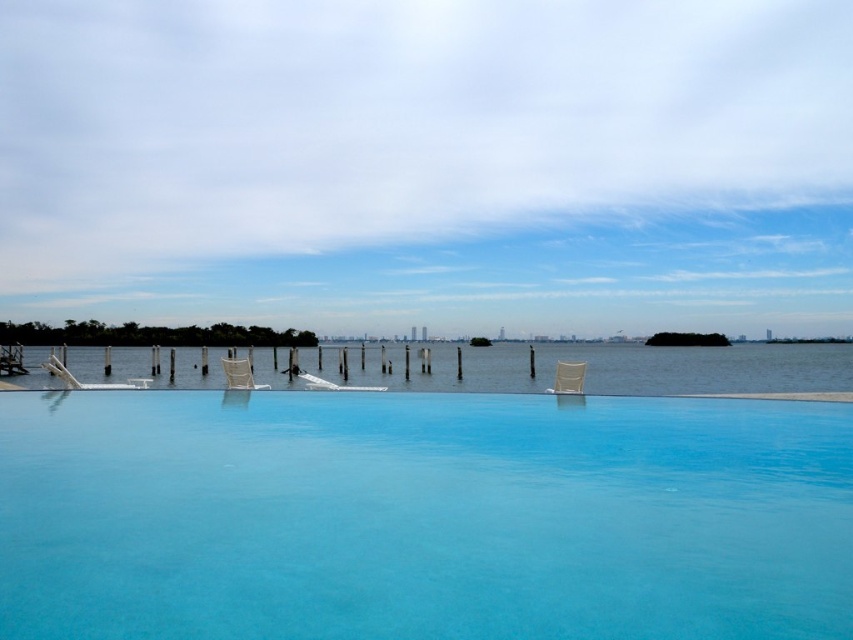
Question: Which object appears closest to the camera in this image?

Choices:
 (A) white fabric beach chair at center
 (B) transparent glass pool at center

Answer: (B)

Question: Among these points, which one is nearest to the camera?

Choices:
 (A) (161, 435)
 (B) (228, 378)
 (C) (579, 362)
 (D) (740, 362)

Answer: (A)

Question: Can you confirm if clear blue water at center is positioned to the right of white fabric beach chair at center?

Choices:
 (A) yes
 (B) no

Answer: (A)

Question: Does white fabric beach chair at center appear under beige fabric beach chair at center?

Choices:
 (A) no
 (B) yes

Answer: (A)

Question: Is white fabric beach chair at center further to the viewer compared to beige fabric beach chair at center?

Choices:
 (A) no
 (B) yes

Answer: (B)

Question: Based on their relative distances, which object is farther from the clear blue water at center?

Choices:
 (A) beige fabric beach chair at center
 (B) transparent glass pool at center
 (C) white fabric beach chair at center

Answer: (B)